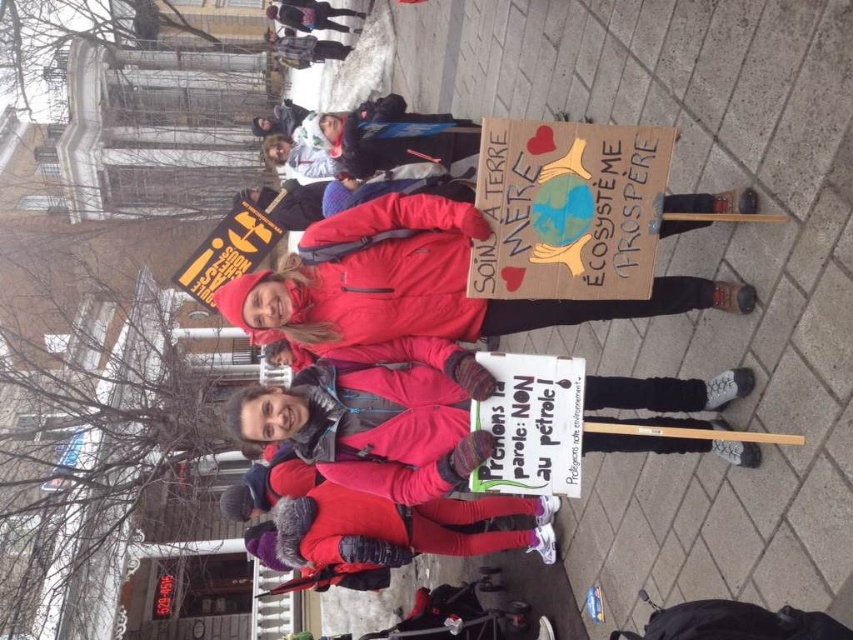
You are a photographer standing at the scene and want to capture a closeup of the matte pink coat at center without moving closer. What is the minimum focal length lens you need to use if your camera sensor is 36mm wide? Assume the coat occupies 100mm in the image.

The minimum focal length required is calculated by multiplying the sensor width by the distance to the subject divided by the object width. However, since the object width here is 100mm and the distance is 28.86 feet, converting feet to millimeters, 28.86 feet is approximately 8800mm. The formula would be focal length equals sensor width times distance divided by object width. Plugging in the numbers, 36mm multiplied by 8800mm divided by 100mm equals 3168mm. Therefore, a 3168mm focal length lens is needed.

You are a photographer standing at the camera position. You want to take a photo of the point at coordinates point (512, 156). How far will you need to move forward or backward to get the point into focus?

The point at coordinates point (512, 156) is 5.44 meters away from the camera. To focus on this point, you would need to adjust your camera settings or move to ensure the focal distance matches this distance. Since the exact movement required depends on your current position and lens focal length, the key detail is that the point is 5.44 meters away.

Consider the image. You are a photographer trying to capture the protest scene. You notice the matte pink coat at center and the matte black backpack at upper center. Which object should you focus on first if you want to photograph the one that is more to the right?

The matte pink coat at center is positioned on the right side of the matte black backpack at upper center, so you should focus on the matte pink coat at center first as it is more to the right.